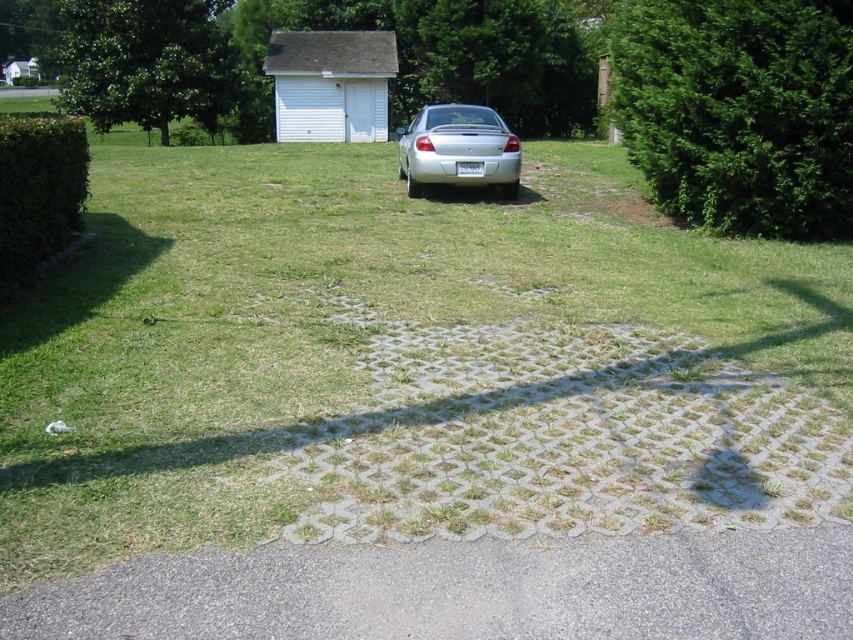
Is gray asphalt driveway at lower center smaller than green leafy hedge at right?

Yes, gray asphalt driveway at lower center is smaller than green leafy hedge at right.

Consider the image. How distant is gray asphalt driveway at lower center from green leafy hedge at right?

gray asphalt driveway at lower center and green leafy hedge at right are 26.77 feet apart from each other.

Which is behind, point (508, 556) or point (740, 188)?

The point (740, 188) is more distant.

Find the location of a particular element. This screenshot has width=853, height=640. gray asphalt driveway at lower center is located at coordinates (465, 589).

Looking at this image, does green leafy hedge at right come behind green leafy hedge at left?

Yes.

Can you confirm if green leafy hedge at right is smaller than green leafy hedge at left?

Yes.

In order to click on green leafy hedge at right in this screenshot , I will do `click(740, 112)`.

Is point (631, 120) positioned after point (428, 134)?

No.

Based on the photo, between green leafy hedge at right and silver metallic car at center, which one has less height?

Standing shorter between the two is green leafy hedge at right.

Who is more distant from viewer, (809,92) or (476,112)?

Positioned behind is point (476,112).

Find the location of a particular element. The height and width of the screenshot is (640, 853). green leafy hedge at right is located at coordinates (740, 112).